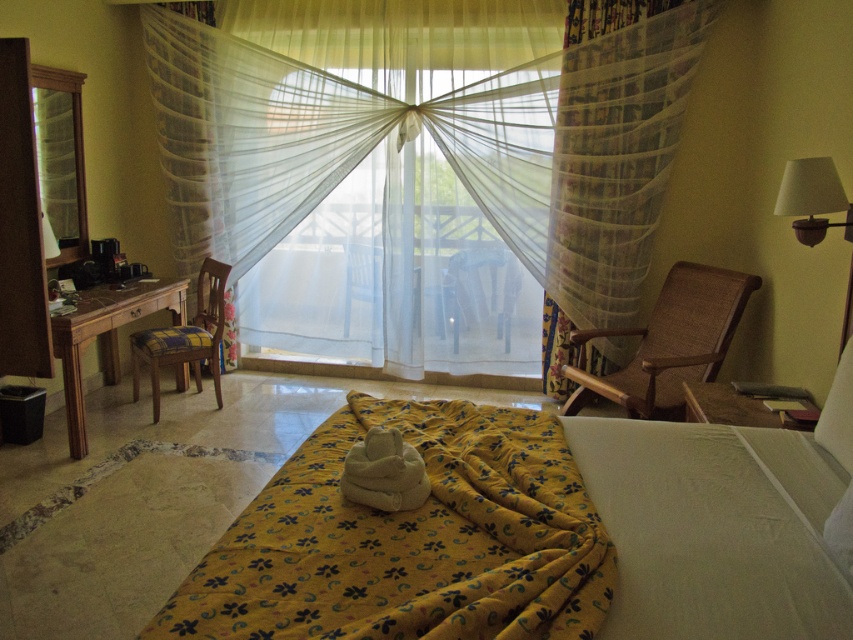
Question: Does sheer white curtain at center appear over white fabric lampshade at upper right?

Choices:
 (A) no
 (B) yes

Answer: (B)

Question: Is sheer floral fabric at right below plaid fabric chair at left?

Choices:
 (A) no
 (B) yes

Answer: (A)

Question: Estimate the real-world distances between objects in this image. Which object is farther from the sheer white curtain at center?

Choices:
 (A) white fabric lampshade at upper right
 (B) sheer floral fabric at right

Answer: (A)

Question: Which point is closer to the camera?

Choices:
 (A) (219, 280)
 (B) (573, 368)

Answer: (B)

Question: Which object appears farthest from the camera in this image?

Choices:
 (A) sheer floral fabric at right
 (B) brown woven rocking chair at right
 (C) sheer white curtain at center
 (D) yellow floral fabric blanket at center

Answer: (C)

Question: Does sheer white curtain at center appear under brown woven rocking chair at right?

Choices:
 (A) yes
 (B) no

Answer: (B)